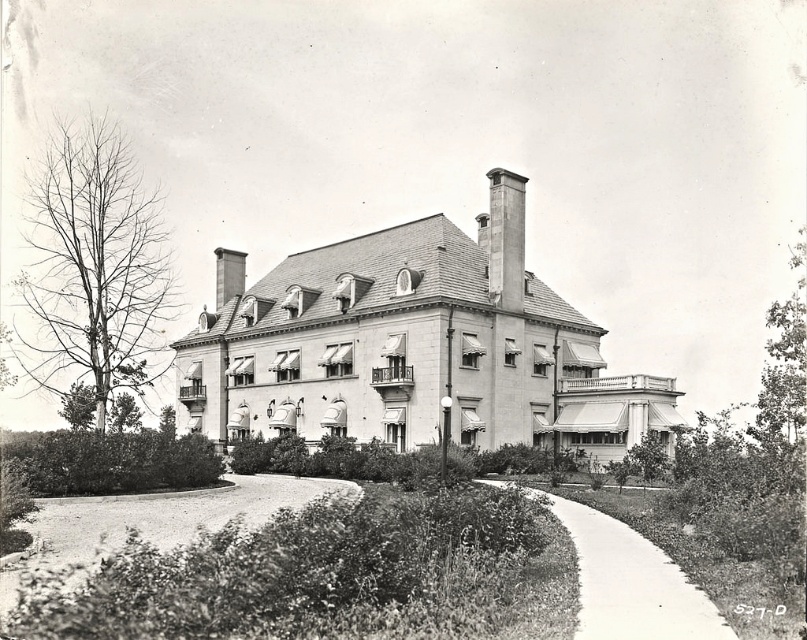
You are a gardener planning to walk from the front gate to the mansion entrance. The entrance is located where the smooth concrete path at lower center leads. There is a smooth stone chimney at upper center above the entrance. Since the path is wider than the chimney, will you have enough space to walk comfortably along the path towards the entrance?

The smooth concrete path at lower center is wider than the smooth stone chimney at upper center, so there will be enough space to walk comfortably along the path towards the entrance.

You are standing at the entrance of the mansion and want to walk towards the smooth stone chimney at upper center. Which direction should you look to see the smooth concrete path at lower center?

The smooth concrete path at lower center is located below the smooth stone chimney at upper center, so you should look downward to see it.